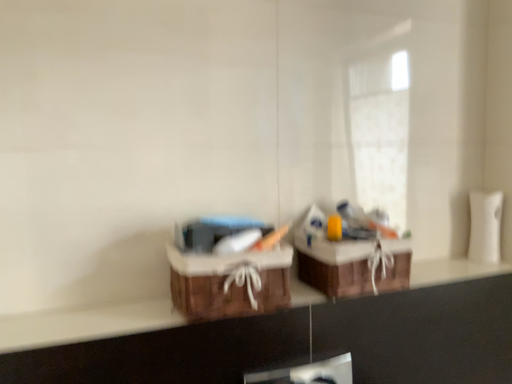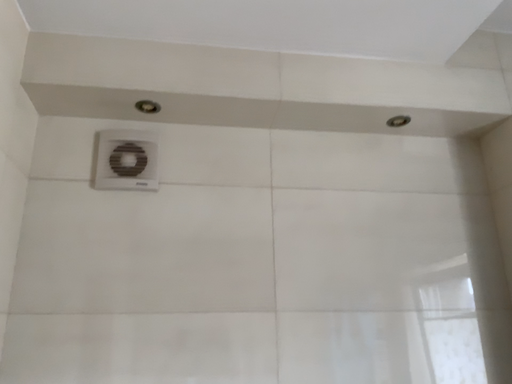
Question: How did the camera likely rotate when shooting the video?

Choices:
 (A) rotated downward
 (B) rotated upward

Answer: (B)